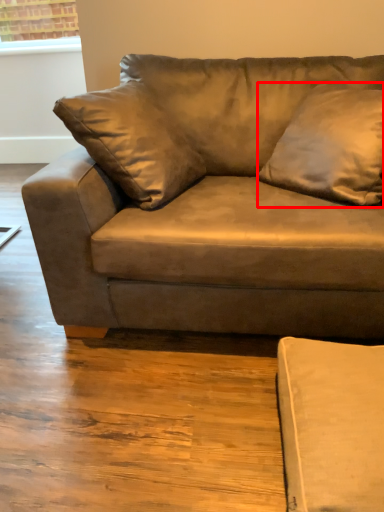
Question: Observing the image, what is the correct spatial positioning of pillow (annotated by the red box) in reference to studio couch?

Choices:
 (A) left
 (B) right

Answer: (B)